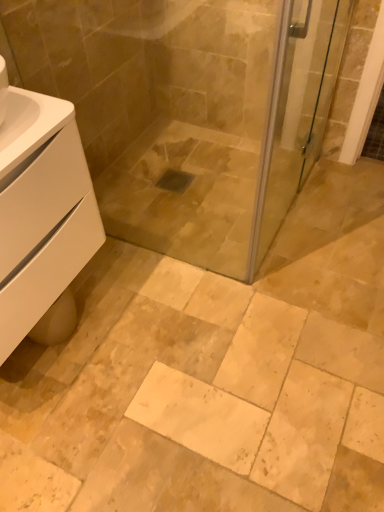
The image size is (384, 512). Identify the location of vacant area that lies to the right of transparent glass screen door at upper right. (327, 207).